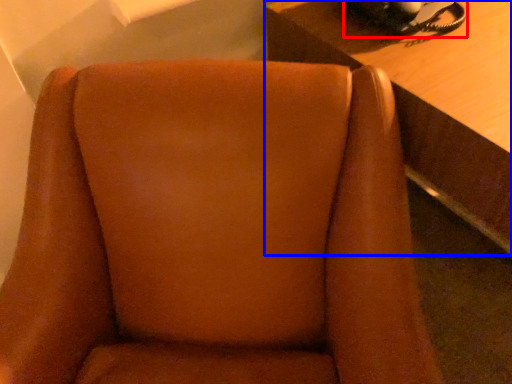
Question: Which object is closer to the camera taking this photo, corded phone (highlighted by a red box) or table (highlighted by a blue box)?

Choices:
 (A) corded phone
 (B) table

Answer: (B)